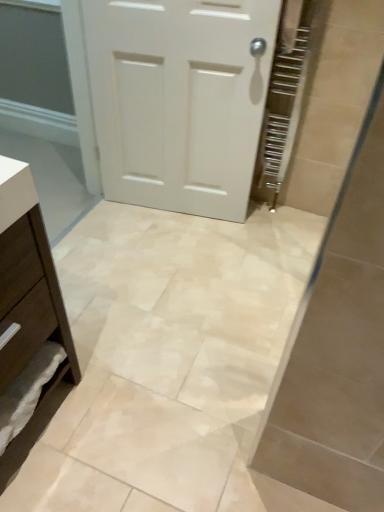
Where is `brown matte chest of drawers at lower left`? The width and height of the screenshot is (384, 512). brown matte chest of drawers at lower left is located at coordinates (29, 282).

The height and width of the screenshot is (512, 384). Describe the element at coordinates (29, 282) in the screenshot. I see `brown matte chest of drawers at lower left` at that location.

Identify the location of white matte door at center. (180, 99).

This screenshot has height=512, width=384. Describe the element at coordinates (180, 99) in the screenshot. I see `white matte door at center` at that location.

What is the approximate height of white matte door at center?

The height of white matte door at center is 3.36 feet.

What are the coordinates of `brown matte chest of drawers at lower left` in the screenshot? It's located at (29, 282).

Considering the relative positions of white matte door at center and brown matte chest of drawers at lower left in the image provided, is white matte door at center to the left of brown matte chest of drawers at lower left from the viewer's perspective?

No, white matte door at center is not to the left of brown matte chest of drawers at lower left.

Relative to brown matte chest of drawers at lower left, is white matte door at center in front or behind?

white matte door at center is positioned farther from the viewer than brown matte chest of drawers at lower left.

Is point (199, 183) less distant than point (28, 215)?

No, (199, 183) is behind (28, 215).

Consider the image. From the image's perspective, which object appears higher, white matte door at center or brown matte chest of drawers at lower left?

white matte door at center appears higher in the image.

From a real-world perspective, which is physically above, white matte door at center or brown matte chest of drawers at lower left?

white matte door at center, from a real-world perspective.

Consider the image. Is white matte door at center wider or thinner than brown matte chest of drawers at lower left?

white matte door at center is thinner than brown matte chest of drawers at lower left.

Based on the photo, considering the sizes of objects white matte door at center and brown matte chest of drawers at lower left in the image provided, who is taller, white matte door at center or brown matte chest of drawers at lower left?

white matte door at center.

Which of these two, white matte door at center or brown matte chest of drawers at lower left, is smaller?

Smaller between the two is white matte door at center.

Can we say white matte door at center lies outside brown matte chest of drawers at lower left?

Yes, white matte door at center is located beyond the bounds of brown matte chest of drawers at lower left.

Does white matte door at center touch brown matte chest of drawers at lower left?

There is a gap between white matte door at center and brown matte chest of drawers at lower left.

Is white matte door at center facing away from brown matte chest of drawers at lower left?

That's not correct — white matte door at center is not looking away from brown matte chest of drawers at lower left.

At what (x,y) coordinates should I click in order to perform the action: click on door above the brown matte chest of drawers at lower left (from the image's perspective). Please return your answer as a coordinate pair (x, y). The height and width of the screenshot is (512, 384). Looking at the image, I should click on coord(180,99).

Considering the positions of objects brown matte chest of drawers at lower left and white matte door at center in the image provided, who is more to the left, brown matte chest of drawers at lower left or white matte door at center?

brown matte chest of drawers at lower left.

Which object is more forward, brown matte chest of drawers at lower left or white matte door at center?

brown matte chest of drawers at lower left is more forward.

Does point (67, 362) appear closer or farther from the camera than point (175, 146)?

Clearly, point (67, 362) is closer to the camera than point (175, 146).

From the image's perspective, does brown matte chest of drawers at lower left appear lower than white matte door at center?

Correct, brown matte chest of drawers at lower left appears lower than white matte door at center in the image.

From a real-world perspective, is brown matte chest of drawers at lower left physically located above or below white matte door at center?

brown matte chest of drawers at lower left is situated lower than white matte door at center in the real world.

Which of these two, brown matte chest of drawers at lower left or white matte door at center, is thinner?

With smaller width is white matte door at center.

From their relative heights in the image, would you say brown matte chest of drawers at lower left is taller or shorter than white matte door at center?

brown matte chest of drawers at lower left is shorter than white matte door at center.

Looking at the image, does brown matte chest of drawers at lower left seem bigger or smaller compared to white matte door at center?

brown matte chest of drawers at lower left is bigger than white matte door at center.

Do you think brown matte chest of drawers at lower left is within white matte door at center, or outside of it?

brown matte chest of drawers at lower left is spatially situated outside white matte door at center.

Is brown matte chest of drawers at lower left not close to white matte door at center?

Yes, brown matte chest of drawers at lower left and white matte door at center are quite far apart.

Could you tell me if brown matte chest of drawers at lower left is facing white matte door at center?

No, brown matte chest of drawers at lower left is not oriented towards white matte door at center.

What's the angular difference between brown matte chest of drawers at lower left and white matte door at center's facing directions?

The angular difference between brown matte chest of drawers at lower left and white matte door at center is 79.1 degrees.

How far apart are brown matte chest of drawers at lower left and white matte door at center?

A distance of 3.29 feet exists between brown matte chest of drawers at lower left and white matte door at center.

Identify the location of the chest of drawers that appears below the white matte door at center (from a real-world perspective). (29, 282).

Locate an element on the screen. chest of drawers on the left of white matte door at center is located at coordinates pos(29,282).

Find the location of `door behind the brown matte chest of drawers at lower left`. door behind the brown matte chest of drawers at lower left is located at coordinates (180, 99).